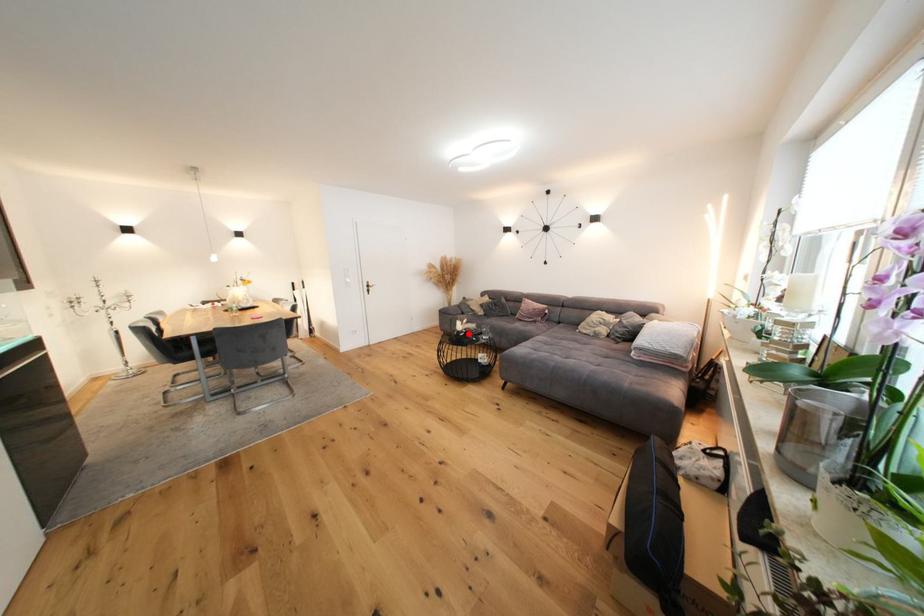
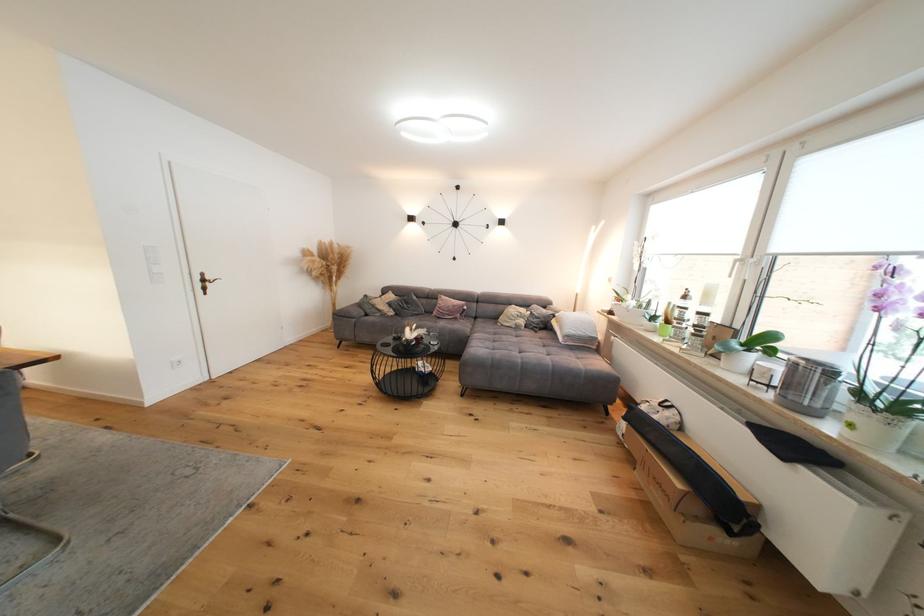
Where in the second image is the point corresponding to the highlighted location from the first image?

(419, 342)